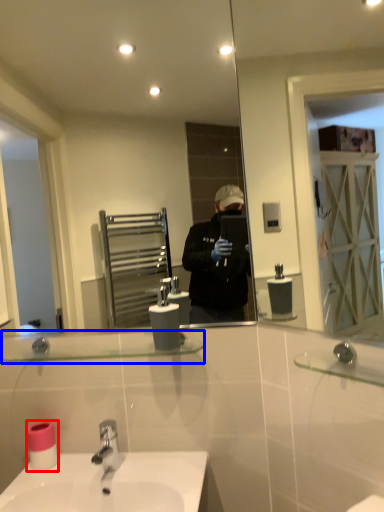
Question: Which of the following is the closest to the observer, toilet paper (highlighted by a red box) or balustrade (highlighted by a blue box)?

Choices:
 (A) toilet paper
 (B) balustrade

Answer: (B)